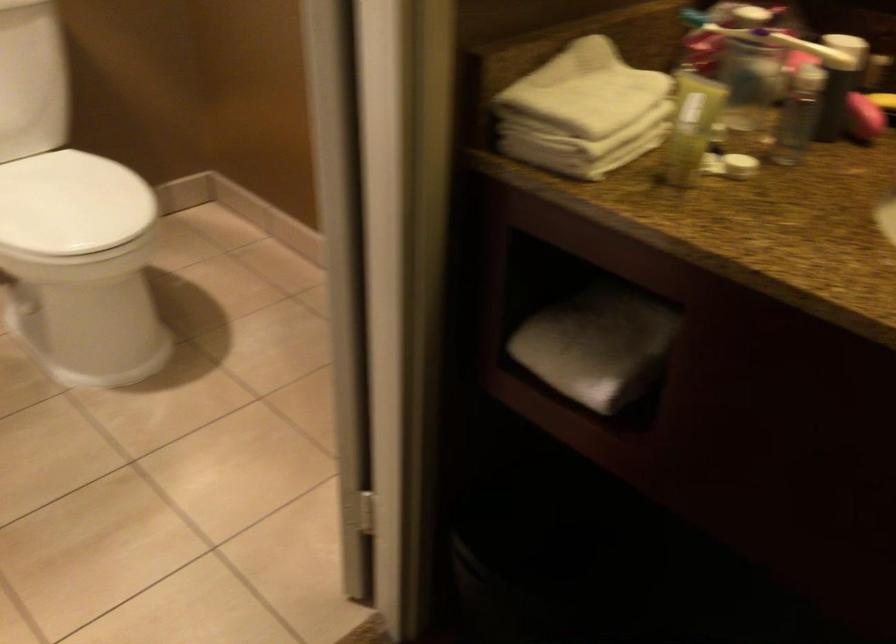
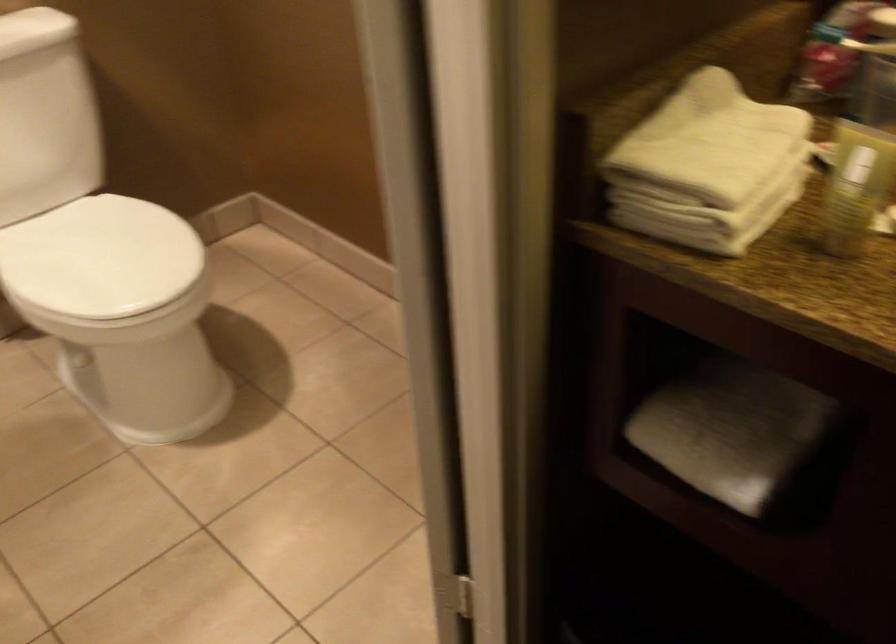
Question: Based on the continuous images, in which direction is the camera rotating? Reply with the corresponding letter.

Choices:
 (A) Left
 (B) Right
 (C) Up
 (D) Down

Answer: (A)